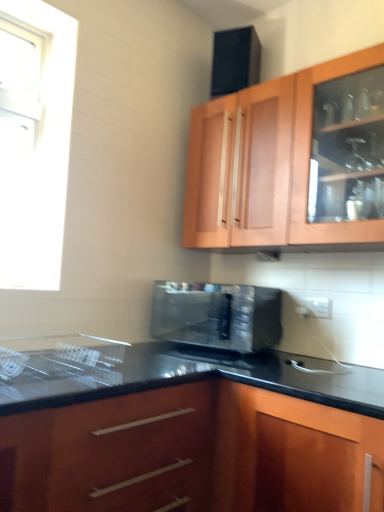
Locate an element on the screen. glossy wood cabinet at lower center, the first cabinetry when ordered from bottom to top is located at coordinates (191, 453).

Describe the element at coordinates (217, 315) in the screenshot. I see `satin black microwave at center` at that location.

Identify the location of glossy wood cabinet at lower center, the first cabinetry when ordered from bottom to top. Image resolution: width=384 pixels, height=512 pixels. (191, 453).

Is white glossy window at upper left located outside glossy wood cabinet at lower center, which is the 2th cabinetry from top to bottom?

That's correct, white glossy window at upper left is outside of glossy wood cabinet at lower center, which is the 2th cabinetry from top to bottom.

Does white glossy window at upper left appear on the right side of glossy wood cabinet at lower center, which is the 2th cabinetry from top to bottom?

Incorrect, white glossy window at upper left is not on the right side of glossy wood cabinet at lower center, which is the 2th cabinetry from top to bottom.

How different are the orientations of white glossy window at upper left and glossy wood cabinet at lower center, the first cabinetry when ordered from bottom to top, in degrees?

89.5 degrees.

In the scene shown: Does white glossy window at upper left have a smaller size compared to glossy wood cabinet at lower center, the first cabinetry when ordered from bottom to top?

Indeed, white glossy window at upper left has a smaller size compared to glossy wood cabinet at lower center, the first cabinetry when ordered from bottom to top.

From a real-world perspective, is satin black microwave at center located higher than white glossy window at upper left?

Actually, satin black microwave at center is physically below white glossy window at upper left in the real world.

Is satin black microwave at center next to white glossy window at upper left?

No, satin black microwave at center is not with white glossy window at upper left.

Would you say satin black microwave at center contains white glossy window at upper left?

Actually, white glossy window at upper left is outside satin black microwave at center.

Which of these two, satin black microwave at center or white glossy window at upper left, stands shorter?

With less height is satin black microwave at center.

Considering the relative positions of glossy wood cabinet at lower center, which is the 2th cabinetry from top to bottom, and white glossy window at upper left in the image provided, is glossy wood cabinet at lower center, which is the 2th cabinetry from top to bottom, in front of white glossy window at upper left?

Yes, glossy wood cabinet at lower center, which is the 2th cabinetry from top to bottom, is closer to the viewer.

Between glossy wood cabinet at lower center, the first cabinetry when ordered from bottom to top, and white glossy window at upper left, which one appears on the right side from the viewer's perspective?

Positioned to the right is glossy wood cabinet at lower center, the first cabinetry when ordered from bottom to top.

Considering the sizes of objects glossy wood cabinet at lower center, which is the 2th cabinetry from top to bottom, and white glossy window at upper left in the image provided, who is wider, glossy wood cabinet at lower center, which is the 2th cabinetry from top to bottom, or white glossy window at upper left?

Wider between the two is glossy wood cabinet at lower center, which is the 2th cabinetry from top to bottom.

Is glossy wood cabinet at lower center, the first cabinetry when ordered from bottom to top, aimed at white glossy window at upper left?

No, glossy wood cabinet at lower center, the first cabinetry when ordered from bottom to top, does not turn towards white glossy window at upper left.

Consider the image. Can you confirm if glossy wood cabinet at lower center, the first cabinetry when ordered from bottom to top, is shorter than wooden cabinet at upper center, acting as the 2th cabinetry starting from the bottom?

No, glossy wood cabinet at lower center, the first cabinetry when ordered from bottom to top, is not shorter than wooden cabinet at upper center, acting as the 2th cabinetry starting from the bottom.

Which is behind, glossy wood cabinet at lower center, which is the 2th cabinetry from top to bottom, or wooden cabinet at upper center, acting as the 2th cabinetry starting from the bottom?

wooden cabinet at upper center, acting as the 2th cabinetry starting from the bottom, is more distant.

Considering the sizes of objects glossy wood cabinet at lower center, the first cabinetry when ordered from bottom to top, and wooden cabinet at upper center, the first cabinetry when ordered from top to bottom, in the image provided, who is smaller, glossy wood cabinet at lower center, the first cabinetry when ordered from bottom to top, or wooden cabinet at upper center, the first cabinetry when ordered from top to bottom,?

Smaller between the two is wooden cabinet at upper center, the first cabinetry when ordered from top to bottom.

From a real-world perspective, does glossy wood cabinet at lower center, which is the 2th cabinetry from top to bottom, sit lower than satin black microwave at center?

Correct, in the physical world, glossy wood cabinet at lower center, which is the 2th cabinetry from top to bottom, is lower than satin black microwave at center.

Looking at this image, could you tell me if glossy wood cabinet at lower center, which is the 2th cabinetry from top to bottom, is turned towards satin black microwave at center?

No, glossy wood cabinet at lower center, which is the 2th cabinetry from top to bottom, does not turn towards satin black microwave at center.

Is glossy wood cabinet at lower center, which is the 2th cabinetry from top to bottom, touching satin black microwave at center?

glossy wood cabinet at lower center, which is the 2th cabinetry from top to bottom, and satin black microwave at center are clearly separated.

The width and height of the screenshot is (384, 512). Identify the location of cabinetry that appears below the satin black microwave at center (from the image's perspective). (191, 453).

From the image's perspective, is white glossy window at upper left beneath satin black microwave at center?

No.

From the picture: Considering the relative positions of white glossy window at upper left and satin black microwave at center in the image provided, is white glossy window at upper left to the right of satin black microwave at center from the viewer's perspective?

No, white glossy window at upper left is not to the right of satin black microwave at center.

How many degrees apart are the facing directions of white glossy window at upper left and satin black microwave at center?

They differ by 78.2 degrees in their facing directions.

Is white glossy window at upper left turned away from satin black microwave at center?

No, satin black microwave at center is not at the back of white glossy window at upper left.

Who is bigger, white glossy window at upper left or wooden cabinet at upper center, acting as the 2th cabinetry starting from the bottom?

wooden cabinet at upper center, acting as the 2th cabinetry starting from the bottom, is bigger.

Is white glossy window at upper left looking in the opposite direction of wooden cabinet at upper center, the first cabinetry when ordered from top to bottom?

No, white glossy window at upper left is not facing away from wooden cabinet at upper center, the first cabinetry when ordered from top to bottom.

From the image's perspective, is white glossy window at upper left on wooden cabinet at upper center, acting as the 2th cabinetry starting from the bottom?

Yes, from the image's perspective, white glossy window at upper left is over wooden cabinet at upper center, acting as the 2th cabinetry starting from the bottom.

From a real-world perspective, is white glossy window at upper left positioned above or below wooden cabinet at upper center, acting as the 2th cabinetry starting from the bottom?

white glossy window at upper left is below wooden cabinet at upper center, acting as the 2th cabinetry starting from the bottom.

The width and height of the screenshot is (384, 512). What are the coordinates of `window behind the glossy wood cabinet at lower center, which is the 2th cabinetry from top to bottom` in the screenshot? It's located at (34, 140).

Where is `window located on the left of satin black microwave at center`? This screenshot has height=512, width=384. window located on the left of satin black microwave at center is located at coordinates (34, 140).

When comparing their distances from wooden cabinet at upper center, the first cabinetry when ordered from top to bottom, does white glossy window at upper left or glossy wood cabinet at lower center, which is the 2th cabinetry from top to bottom, seem closer?

white glossy window at upper left is positioned closer to the anchor wooden cabinet at upper center, the first cabinetry when ordered from top to bottom.

Considering their positions, is glossy wood cabinet at lower center, which is the 2th cabinetry from top to bottom, positioned closer to satin black microwave at center than wooden cabinet at upper center, the first cabinetry when ordered from top to bottom?

Based on the image, wooden cabinet at upper center, the first cabinetry when ordered from top to bottom, appears to be nearer to satin black microwave at center.

Considering their positions, is white glossy window at upper left positioned closer to satin black microwave at center than glossy wood cabinet at lower center, the first cabinetry when ordered from bottom to top?

The object closer to satin black microwave at center is glossy wood cabinet at lower center, the first cabinetry when ordered from bottom to top.

When comparing their distances from white glossy window at upper left, does satin black microwave at center or wooden cabinet at upper center, acting as the 2th cabinetry starting from the bottom, seem further?

Among the two, wooden cabinet at upper center, acting as the 2th cabinetry starting from the bottom, is located further to white glossy window at upper left.

From the image, which object appears to be farther from wooden cabinet at upper center, acting as the 2th cabinetry starting from the bottom, white glossy window at upper left or satin black microwave at center?

Among the two, white glossy window at upper left is located further to wooden cabinet at upper center, acting as the 2th cabinetry starting from the bottom.

From the image, which object appears to be nearer to satin black microwave at center, wooden cabinet at upper center, acting as the 2th cabinetry starting from the bottom, or glossy wood cabinet at lower center, the first cabinetry when ordered from bottom to top?

wooden cabinet at upper center, acting as the 2th cabinetry starting from the bottom, is positioned closer to the anchor satin black microwave at center.

When comparing their distances from white glossy window at upper left, does satin black microwave at center or glossy wood cabinet at lower center, the first cabinetry when ordered from bottom to top, seem further?

Based on the image, glossy wood cabinet at lower center, the first cabinetry when ordered from bottom to top, appears to be further to white glossy window at upper left.

Based on their spatial positions, is white glossy window at upper left or wooden cabinet at upper center, acting as the 2th cabinetry starting from the bottom, further from glossy wood cabinet at lower center, which is the 2th cabinetry from top to bottom?

white glossy window at upper left lies further to glossy wood cabinet at lower center, which is the 2th cabinetry from top to bottom, than the other object.

Where is `microwave oven that lies between white glossy window at upper left and glossy wood cabinet at lower center, the first cabinetry when ordered from bottom to top, from top to bottom`? microwave oven that lies between white glossy window at upper left and glossy wood cabinet at lower center, the first cabinetry when ordered from bottom to top, from top to bottom is located at coordinates (217, 315).

Identify the location of microwave oven between wooden cabinet at upper center, the first cabinetry when ordered from top to bottom, and glossy wood cabinet at lower center, which is the 2th cabinetry from top to bottom, in the vertical direction. (217, 315).

You are a GUI agent. You are given a task and a screenshot of the screen. Output one action in this format:
    pyautogui.click(x=<x>, y=<y>)
    Task: Click on the cabinetry between white glossy window at upper left and glossy wood cabinet at lower center, the first cabinetry when ordered from bottom to top, in the up-down direction
    The image size is (384, 512).
    Given the screenshot: What is the action you would take?
    pyautogui.click(x=291, y=160)

I want to click on microwave oven between white glossy window at upper left and wooden cabinet at upper center, acting as the 2th cabinetry starting from the bottom, from left to right, so click(x=217, y=315).